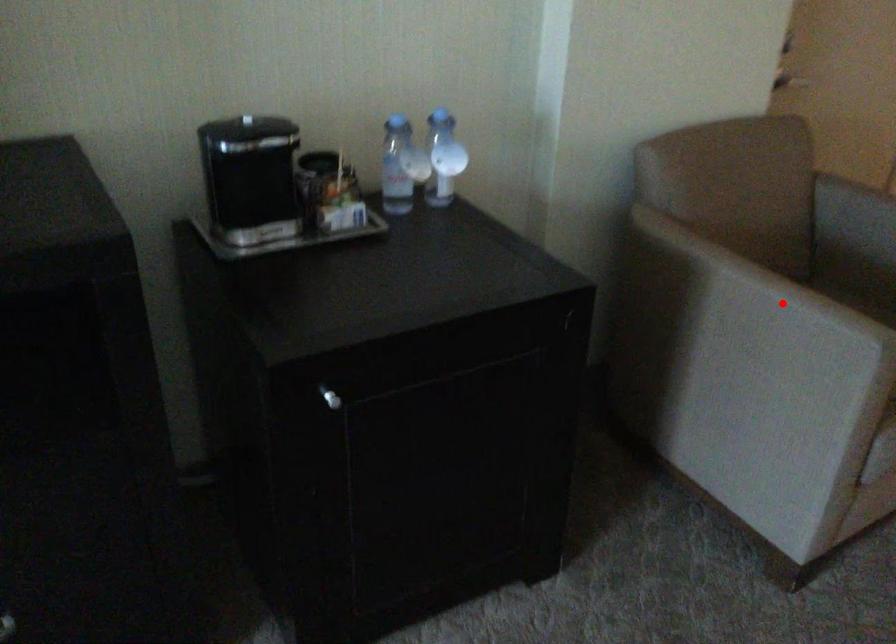
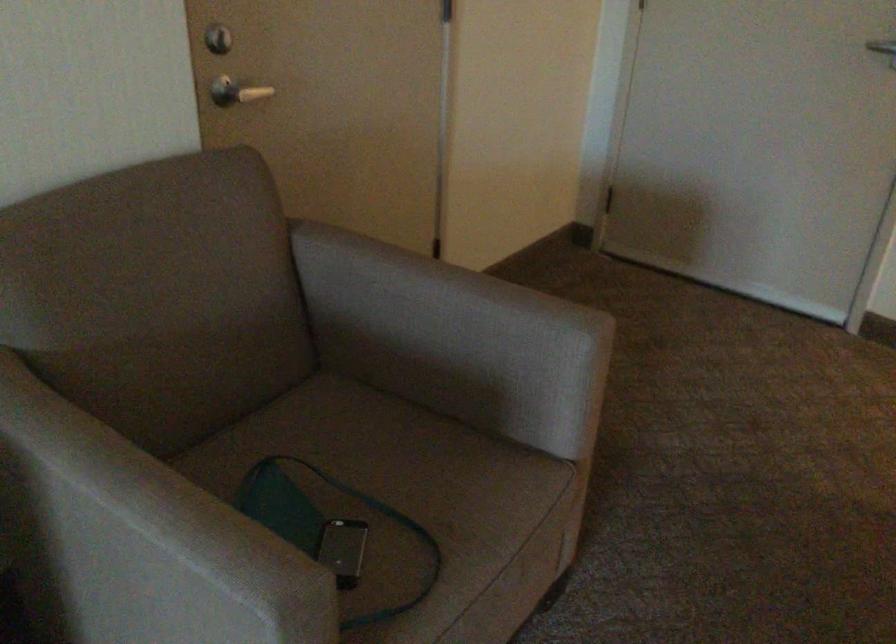
Question: A red point is marked in image1. In image2, is the corresponding 3D point closer to the camera or farther? Reply with the corresponding letter.

Choices:
 (A) The corresponding 3D point is closer.
 (B) The corresponding 3D point is farther.

Answer: (A)